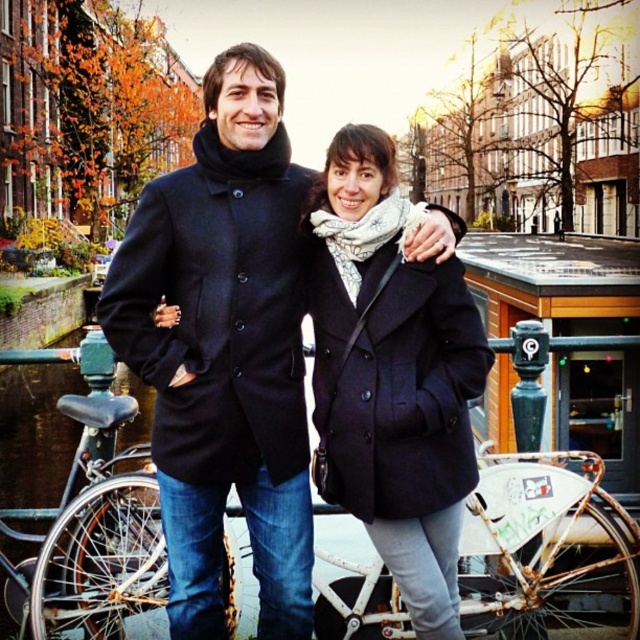
Question: Which point is farther to the camera?

Choices:
 (A) (120, 356)
 (B) (432, 529)

Answer: (A)

Question: Can you confirm if black wool coat at center is positioned to the right of matte black coat at center?

Choices:
 (A) yes
 (B) no

Answer: (B)

Question: Can you confirm if black wool coat at center is bigger than matte black coat at center?

Choices:
 (A) no
 (B) yes

Answer: (B)

Question: Which point is farther to the camera?

Choices:
 (A) (406, 333)
 (B) (252, 198)

Answer: (B)

Question: Is black wool coat at center bigger than matte black coat at center?

Choices:
 (A) no
 (B) yes

Answer: (B)